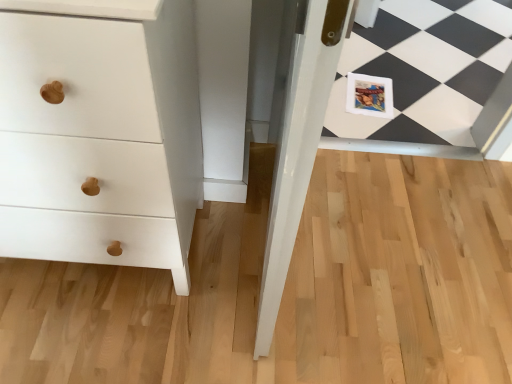
The height and width of the screenshot is (384, 512). What are the coordinates of `white matte wood chest of drawers at left` in the screenshot? It's located at (100, 132).

Describe the element at coordinates (100, 132) in the screenshot. I see `white matte wood chest of drawers at left` at that location.

Consider the image. Measure the distance between white matte wood chest of drawers at left and camera.

white matte wood chest of drawers at left and camera are 22.01 inches apart.

The width and height of the screenshot is (512, 384). What do you see at coordinates (369, 95) in the screenshot? I see `matte paper postcard at center` at bounding box center [369, 95].

You are a GUI agent. You are given a task and a screenshot of the screen. Output one action in this format:
    pyautogui.click(x=<x>, y=<y>)
    Task: Click on the matte paper postcard at center
    Image resolution: width=512 pixels, height=384 pixels.
    Given the screenshot: What is the action you would take?
    point(369,95)

Identify the location of white matte wood chest of drawers at left. (100, 132).

Is matte paper postcard at center at the left side of white matte wood chest of drawers at left?

Incorrect, matte paper postcard at center is not on the left side of white matte wood chest of drawers at left.

Is the position of matte paper postcard at center less distant than that of white matte wood chest of drawers at left?

No, matte paper postcard at center is further to the viewer.

Is point (346, 109) positioned before point (191, 62)?

No, (346, 109) is behind (191, 62).

From the image's perspective, is matte paper postcard at center beneath white matte wood chest of drawers at left?

No, from the image's perspective, matte paper postcard at center is not below white matte wood chest of drawers at left.

From a real-world perspective, who is located higher, matte paper postcard at center or white matte wood chest of drawers at left?

white matte wood chest of drawers at left.

Which of these two, matte paper postcard at center or white matte wood chest of drawers at left, is wider?

Wider between the two is white matte wood chest of drawers at left.

Is matte paper postcard at center taller or shorter than white matte wood chest of drawers at left?

matte paper postcard at center is shorter than white matte wood chest of drawers at left.

Considering the sizes of objects matte paper postcard at center and white matte wood chest of drawers at left in the image provided, who is smaller, matte paper postcard at center or white matte wood chest of drawers at left?

With smaller size is matte paper postcard at center.

Is matte paper postcard at center situated inside white matte wood chest of drawers at left or outside?

matte paper postcard at center is not enclosed by white matte wood chest of drawers at left.

Is matte paper postcard at center beside white matte wood chest of drawers at left?

No, matte paper postcard at center is not next to white matte wood chest of drawers at left.

Is matte paper postcard at center facing towards white matte wood chest of drawers at left?

No, matte paper postcard at center is not turned towards white matte wood chest of drawers at left.

How distant is matte paper postcard at center from white matte wood chest of drawers at left?

They are 4.09 feet apart.

The height and width of the screenshot is (384, 512). I want to click on the chest of drawers located above the matte paper postcard at center (from a real-world perspective), so click(100, 132).

Considering the positions of objects white matte wood chest of drawers at left and matte paper postcard at center in the image provided, who is more to the right, white matte wood chest of drawers at left or matte paper postcard at center?

matte paper postcard at center is more to the right.

Is the position of white matte wood chest of drawers at left less distant than that of matte paper postcard at center?

Yes, white matte wood chest of drawers at left is closer to the camera.

Which is behind, point (21, 87) or point (381, 92)?

Point (381, 92)

From the image's perspective, which object appears higher, white matte wood chest of drawers at left or matte paper postcard at center?

matte paper postcard at center.

From a real-world perspective, between white matte wood chest of drawers at left and matte paper postcard at center, who is vertically higher?

From a 3D spatial view, white matte wood chest of drawers at left is above.

Looking at their sizes, would you say white matte wood chest of drawers at left is wider or thinner than matte paper postcard at center?

Considering their sizes, white matte wood chest of drawers at left looks broader than matte paper postcard at center.

Can you confirm if white matte wood chest of drawers at left is taller than matte paper postcard at center?

Indeed, white matte wood chest of drawers at left has a greater height compared to matte paper postcard at center.

Looking at the image, does white matte wood chest of drawers at left seem bigger or smaller compared to matte paper postcard at center?

Considering their sizes, white matte wood chest of drawers at left takes up more space than matte paper postcard at center.

Would you say white matte wood chest of drawers at left is outside matte paper postcard at center?

Yes.

Are white matte wood chest of drawers at left and matte paper postcard at center beside each other?

white matte wood chest of drawers at left is not next to matte paper postcard at center, and they're not touching.

Is white matte wood chest of drawers at left oriented towards matte paper postcard at center?

No, white matte wood chest of drawers at left is not facing towards matte paper postcard at center.

At what (x,y) coordinates should I click in order to perform the action: click on chest of drawers on the left of the matte paper postcard at center. Please return your answer as a coordinate pair (x, y). The image size is (512, 384). Looking at the image, I should click on (100, 132).

Where is `postcard on the right of white matte wood chest of drawers at left`? This screenshot has height=384, width=512. postcard on the right of white matte wood chest of drawers at left is located at coordinates (369, 95).

Locate an element on the screen. Image resolution: width=512 pixels, height=384 pixels. the chest of drawers above the matte paper postcard at center (from a real-world perspective) is located at coordinates (100, 132).